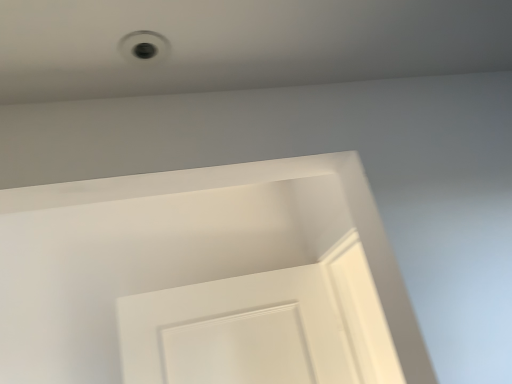
Question: In terms of size, does white matte door at center appear bigger or smaller than white plastic hole at upper center?

Choices:
 (A) small
 (B) big

Answer: (B)

Question: From a real-world perspective, relative to white plastic hole at upper center, is white matte door at center vertically above or below?

Choices:
 (A) below
 (B) above

Answer: (A)

Question: In the image, is white matte door at center on the left side or the right side of white plastic hole at upper center?

Choices:
 (A) left
 (B) right

Answer: (A)

Question: From a real-world perspective, is white plastic hole at upper center positioned above or below white matte door at center?

Choices:
 (A) above
 (B) below

Answer: (A)

Question: In terms of height, does white plastic hole at upper center look taller or shorter compared to white matte door at center?

Choices:
 (A) short
 (B) tall

Answer: (A)

Question: Is white plastic hole at upper center bigger or smaller than white matte door at center?

Choices:
 (A) small
 (B) big

Answer: (A)

Question: In the image, is white plastic hole at upper center on the left side or the right side of white matte door at center?

Choices:
 (A) right
 (B) left

Answer: (A)